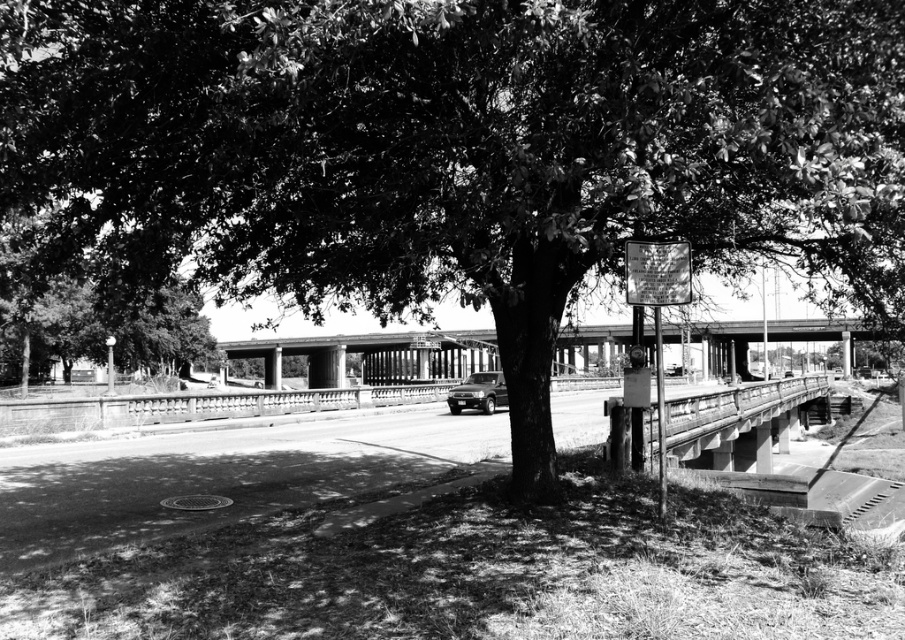
Is green leafy tree at left below concrete bridge at center?

No.

Which of these two, green leafy tree at left or concrete bridge at center, stands shorter?

green leafy tree at left is shorter.

The height and width of the screenshot is (640, 905). I want to click on green leafy tree at left, so click(88, 316).

In order to click on green leafy tree at left in this screenshot , I will do `click(88, 316)`.